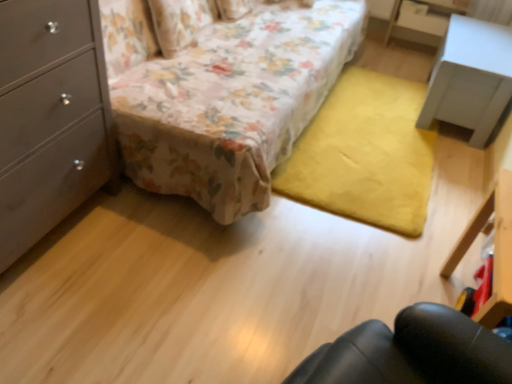
What is the approximate width of white matte nightstand at upper right?

It is 16.74 inches.

What do you see at coordinates (494, 249) in the screenshot? I see `black plastic vanity at lower right` at bounding box center [494, 249].

Describe the element at coordinates (50, 117) in the screenshot. This screenshot has width=512, height=384. I see `matte gray dresser at left` at that location.

What do you see at coordinates (180, 22) in the screenshot? I see `floral fabric pillow at upper left` at bounding box center [180, 22].

Where is `white matte nightstand at upper right`? The height and width of the screenshot is (384, 512). white matte nightstand at upper right is located at coordinates (470, 78).

Can you tell me how much matte gray dresser at left and floral fabric couch at center differ in facing direction?

matte gray dresser at left and floral fabric couch at center are facing 1.03 degrees away from each other.

Is matte gray dresser at left facing towards floral fabric couch at center?

No, matte gray dresser at left is not aimed at floral fabric couch at center.

In the scene shown: Considering the sizes of objects matte gray dresser at left and floral fabric couch at center in the image provided, who is shorter, matte gray dresser at left or floral fabric couch at center?

matte gray dresser at left.

Considering their positions, is matte gray dresser at left located in front of or behind floral fabric couch at center?

In the image, matte gray dresser at left appears in front of floral fabric couch at center.

Does black plastic vanity at lower right have a lesser height compared to floral fabric couch at center?

Indeed, black plastic vanity at lower right has a lesser height compared to floral fabric couch at center.

Consider the image. Does black plastic vanity at lower right have a larger size compared to floral fabric couch at center?

Actually, black plastic vanity at lower right might be smaller than floral fabric couch at center.

Considering their positions, is black plastic vanity at lower right located in front of or behind floral fabric couch at center?

black plastic vanity at lower right is positioned closer to the viewer than floral fabric couch at center.

The height and width of the screenshot is (384, 512). Find the location of `studio couch above the black plastic vanity at lower right (from the image's perspective)`. studio couch above the black plastic vanity at lower right (from the image's perspective) is located at coordinates (233, 101).

From a real-world perspective, is white matte nightstand at upper right above or below black plastic vanity at lower right?

white matte nightstand at upper right is below black plastic vanity at lower right.

Measure the distance from white matte nightstand at upper right to black plastic vanity at lower right.

The distance of white matte nightstand at upper right from black plastic vanity at lower right is 1.14 meters.

Which is more to the right, white matte nightstand at upper right or black plastic vanity at lower right?

white matte nightstand at upper right.

From the image's perspective, is white matte nightstand at upper right positioned above or below black plastic vanity at lower right?

white matte nightstand at upper right is above black plastic vanity at lower right.

Is white matte nightstand at upper right inside the boundaries of floral fabric couch at center, or outside?

white matte nightstand at upper right is located beyond the bounds of floral fabric couch at center.

In terms of width, does white matte nightstand at upper right look wider or thinner when compared to floral fabric couch at center?

white matte nightstand at upper right is thinner than floral fabric couch at center.

From the image's perspective, would you say white matte nightstand at upper right is shown under floral fabric couch at center?

Yes.

From the image's perspective, is black plastic vanity at lower right positioned above or below white matte nightstand at upper right?

Clearly, from the image's perspective, black plastic vanity at lower right is below white matte nightstand at upper right.

Could you tell me if black plastic vanity at lower right is turned towards white matte nightstand at upper right?

No, black plastic vanity at lower right is not oriented towards white matte nightstand at upper right.

From a real-world perspective, which is physically below, black plastic vanity at lower right or white matte nightstand at upper right?

white matte nightstand at upper right is physically lower.

Is black plastic vanity at lower right smaller than white matte nightstand at upper right?

Yes.

Based on the photo, which of these two, black plastic vanity at lower right or floral fabric pillow at upper left, stands taller?

black plastic vanity at lower right.

Considering their positions, is black plastic vanity at lower right located in front of or behind floral fabric pillow at upper left?

Clearly, black plastic vanity at lower right is in front of floral fabric pillow at upper left.

From the picture: From a real-world perspective, is black plastic vanity at lower right under floral fabric pillow at upper left?

Yes, from a real-world perspective, black plastic vanity at lower right is under floral fabric pillow at upper left.

From the image's perspective, between black plastic vanity at lower right and floral fabric pillow at upper left, who is located below?

black plastic vanity at lower right, from the image's perspective.

Could you tell me if floral fabric couch at center is turned towards floral fabric pillow at upper left?

Yes, floral fabric couch at center is turned towards floral fabric pillow at upper left.

Can floral fabric pillow at upper left be found inside floral fabric couch at center?

Absolutely, floral fabric pillow at upper left is inside floral fabric couch at center.

Does point (169, 167) come closer to viewer compared to point (170, 8)?

Yes.

At what (x,y) coordinates should I click in order to perform the action: click on studio couch behind the matte gray dresser at left. Please return your answer as a coordinate pair (x, y). The width and height of the screenshot is (512, 384). Looking at the image, I should click on (233, 101).

In the image, there is a black plastic vanity at lower right. At what (x,y) coordinates should I click in order to perform the action: click on studio couch above it (from the image's perspective). Please return your answer as a coordinate pair (x, y). The width and height of the screenshot is (512, 384). Looking at the image, I should click on (233, 101).

Which object lies nearer to the anchor point floral fabric couch at center, matte gray dresser at left or black plastic vanity at lower right?

matte gray dresser at left lies closer to floral fabric couch at center than the other object.

Based on their spatial positions, is floral fabric couch at center or white matte nightstand at upper right further from black plastic vanity at lower right?

Based on the image, floral fabric couch at center appears to be further to black plastic vanity at lower right.

Looking at this image, from the image, which object appears to be farther from floral fabric pillow at upper left, white matte nightstand at upper right or floral fabric couch at center?

The object further to floral fabric pillow at upper left is white matte nightstand at upper right.

Looking at the image, which one is located closer to floral fabric couch at center, white matte nightstand at upper right or floral fabric pillow at upper left?

floral fabric pillow at upper left is closer to floral fabric couch at center.

From the image, which object appears to be farther from white matte nightstand at upper right, floral fabric couch at center or matte gray dresser at left?

matte gray dresser at left is further to white matte nightstand at upper right.

Estimate the real-world distances between objects in this image. Which object is further from black plastic vanity at lower right, matte gray dresser at left or floral fabric couch at center?

The object further to black plastic vanity at lower right is matte gray dresser at left.

Consider the image. Which object lies nearer to the anchor point white matte nightstand at upper right, floral fabric pillow at upper left or floral fabric couch at center?

The object closer to white matte nightstand at upper right is floral fabric couch at center.

Which object lies nearer to the anchor point floral fabric pillow at upper left, matte gray dresser at left or black plastic vanity at lower right?

Based on the image, matte gray dresser at left appears to be nearer to floral fabric pillow at upper left.

Where is `pillow between floral fabric couch at center and black plastic vanity at lower right in the up-down direction`? The height and width of the screenshot is (384, 512). pillow between floral fabric couch at center and black plastic vanity at lower right in the up-down direction is located at coordinates (180, 22).

Where is `vanity between matte gray dresser at left and white matte nightstand at upper right in the horizontal direction`? vanity between matte gray dresser at left and white matte nightstand at upper right in the horizontal direction is located at coordinates (494, 249).

Locate an element on the screen. This screenshot has height=384, width=512. pillow between matte gray dresser at left and white matte nightstand at upper right in the horizontal direction is located at coordinates (180, 22).

The height and width of the screenshot is (384, 512). I want to click on studio couch situated between matte gray dresser at left and white matte nightstand at upper right from left to right, so click(233, 101).